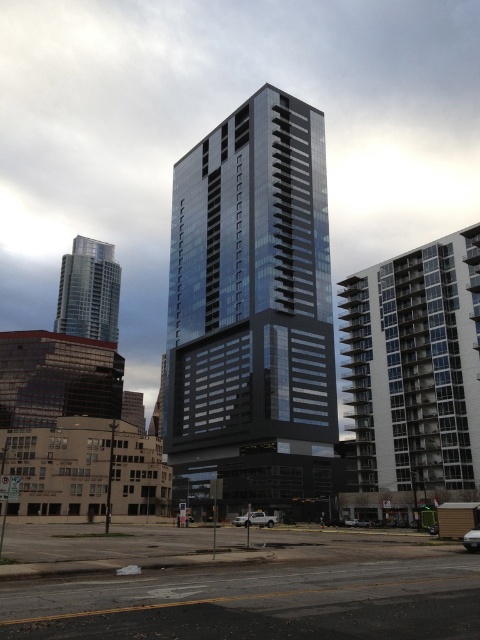
What are the coordinates of the glassy metallic building at center?

The glassy metallic building at center is located at coordinates point (252,310).

You are a delivery driver approaching the white matte truck at lower center in the city scene. You need to park behind the glassy metallic building at center. Is the truck currently positioned in a way that allows you to park behind the building without moving the truck?

The glassy metallic building at center is positioned over the white matte truck at lower center, meaning the truck is directly beneath the building. Since the truck is already under the building, you cannot park behind it without moving the truck.